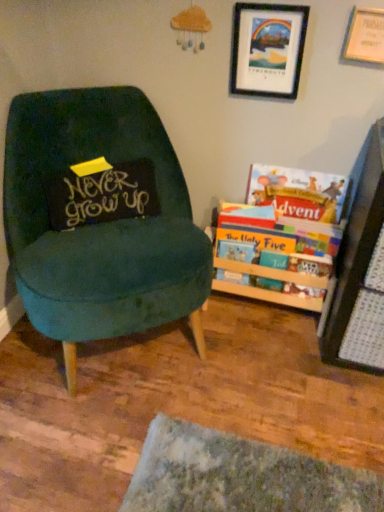
Question: Could you tell me if black matte picture frame at upper right, placed as the 1th picture frame when sorted from left to right, is facing black fabric pillow at left?

Choices:
 (A) yes
 (B) no

Answer: (B)

Question: From the image's perspective, does black matte picture frame at upper right, the 2th picture frame viewed from the right, appear lower than black fabric pillow at left?

Choices:
 (A) yes
 (B) no

Answer: (B)

Question: Is black matte picture frame at upper right, the 2th picture frame viewed from the right, located outside black fabric pillow at left?

Choices:
 (A) yes
 (B) no

Answer: (A)

Question: Does black matte picture frame at upper right, placed as the 1th picture frame when sorted from left to right, have a smaller size compared to black fabric pillow at left?

Choices:
 (A) no
 (B) yes

Answer: (B)

Question: Is black matte picture frame at upper right, placed as the 1th picture frame when sorted from left to right, next to black fabric pillow at left and touching it?

Choices:
 (A) yes
 (B) no

Answer: (B)

Question: Considering the relative sizes of black matte picture frame at upper right, placed as the 1th picture frame when sorted from left to right, and black fabric pillow at left in the image provided, is black matte picture frame at upper right, placed as the 1th picture frame when sorted from left to right, wider than black fabric pillow at left?

Choices:
 (A) no
 (B) yes

Answer: (A)

Question: Considering the relative sizes of wooden picture frame at upper right, the 2th picture frame from the left, and hardcover book at right, the 1th book in the bottom-to-top sequence, in the image provided, is wooden picture frame at upper right, the 2th picture frame from the left, smaller than hardcover book at right, the 1th book in the bottom-to-top sequence,?

Choices:
 (A) yes
 (B) no

Answer: (A)

Question: Is wooden picture frame at upper right, positioned as the first picture frame in right-to-left order, at the right side of hardcover book at right, the 1th book in the bottom-to-top sequence?

Choices:
 (A) no
 (B) yes

Answer: (B)

Question: Is wooden picture frame at upper right, positioned as the first picture frame in right-to-left order, completely or partially outside of hardcover book at right, the third book from the top?

Choices:
 (A) yes
 (B) no

Answer: (A)

Question: Does wooden picture frame at upper right, the 2th picture frame from the left, touch hardcover book at right, the 1th book in the bottom-to-top sequence?

Choices:
 (A) no
 (B) yes

Answer: (A)

Question: Can you confirm if wooden picture frame at upper right, the 2th picture frame from the left, is wider than hardcover book at right, the third book from the top?

Choices:
 (A) no
 (B) yes

Answer: (A)

Question: Is the depth of wooden picture frame at upper right, positioned as the first picture frame in right-to-left order, greater than that of hardcover book at right, the 1th book in the bottom-to-top sequence?

Choices:
 (A) yes
 (B) no

Answer: (B)

Question: Would you say black fabric pillow at left is a long distance from teal velvet chair at left?

Choices:
 (A) no
 (B) yes

Answer: (A)